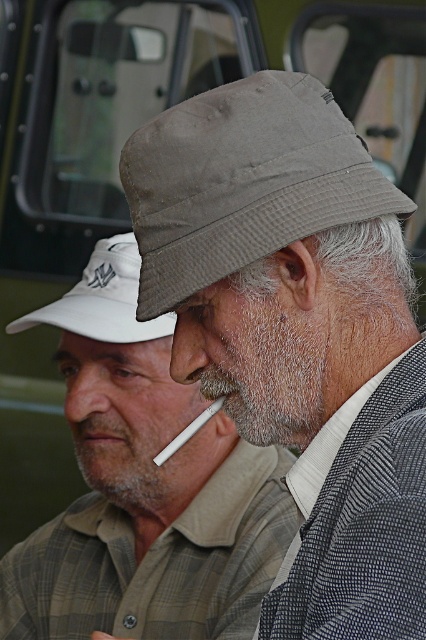
Question: Can you confirm if gray fabric hat at upper center is positioned to the left of matte gray nose at center?

Choices:
 (A) yes
 (B) no

Answer: (A)

Question: Which object is closer to the camera taking this photo?

Choices:
 (A) gray fabric hat at center
 (B) matte gray nose at center

Answer: (A)

Question: Which point is farther to the camera?

Choices:
 (A) white matte cigarette at center
 (B) white fabric cap at upper left

Answer: (B)

Question: Does dry skin nose at center come in front of gray hair at upper center?

Choices:
 (A) yes
 (B) no

Answer: (A)

Question: Which object is farther from the camera taking this photo?

Choices:
 (A) gray fabric hat at center
 (B) dry skin nose at center
 (C) white matte cigarette at center

Answer: (B)

Question: Does dry skin nose at center appear under white matte cigarette at center?

Choices:
 (A) no
 (B) yes

Answer: (A)